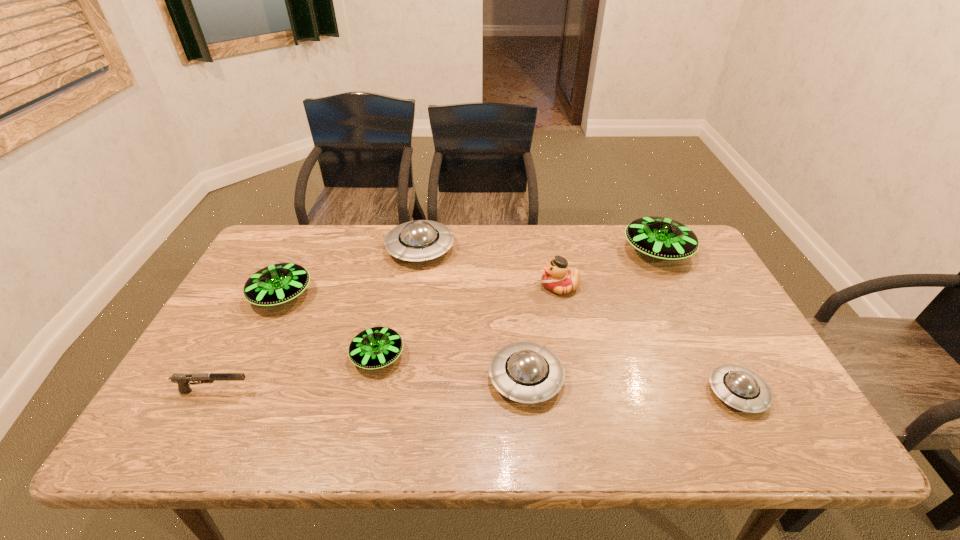
This screenshot has height=540, width=960. Identify the location of free region at the right edge of the desktop. (748, 327).

In the image, there is a desktop. At what (x,y) coordinates should I click in order to perform the action: click on vacant space at the far left corner. Please return your answer as a coordinate pair (x, y). Image resolution: width=960 pixels, height=540 pixels. Looking at the image, I should click on (317, 224).

Identify the location of unoccupied area between the gray gun and the biggest gray saucer. The width and height of the screenshot is (960, 540). 318,320.

The image size is (960, 540). In order to click on empty location between the fourth nearest saucer and the smallest green saucer in this screenshot , I will do `click(329, 326)`.

Find the location of a particular element. free spot between the biggest green saucer and the red duck is located at coordinates (609, 269).

Where is `free space that is in between the farthest gray saucer and the fourth saucer from left to right`? free space that is in between the farthest gray saucer and the fourth saucer from left to right is located at coordinates (473, 314).

Identify the location of free space between the biggest gray saucer and the red duck. (490, 268).

The height and width of the screenshot is (540, 960). What are the coordinates of `free space between the leftmost gray saucer and the third saucer from right to left` in the screenshot? It's located at (473, 314).

The width and height of the screenshot is (960, 540). In order to click on free space that is in between the leftmost green saucer and the second biggest gray saucer in this screenshot , I will do `click(404, 337)`.

This screenshot has height=540, width=960. In order to click on free space between the farthest gray saucer and the smallest gray saucer in this screenshot , I will do `click(579, 321)`.